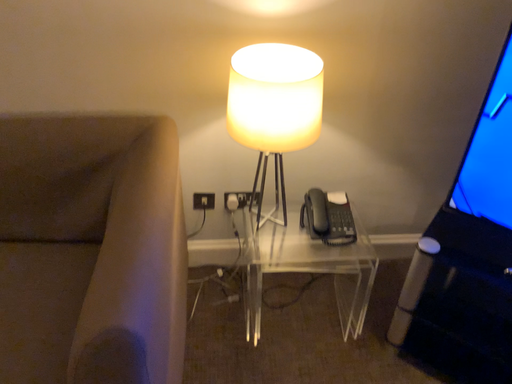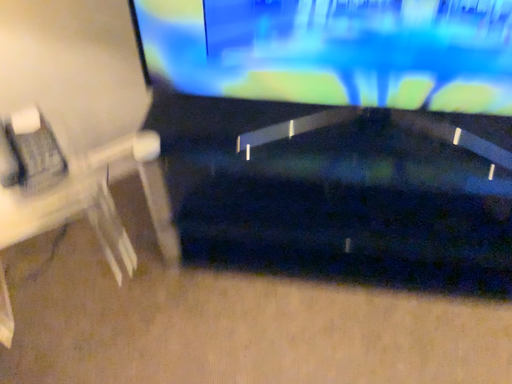
Question: How did the camera likely rotate when shooting the video?

Choices:
 (A) rotated left
 (B) rotated right

Answer: (B)